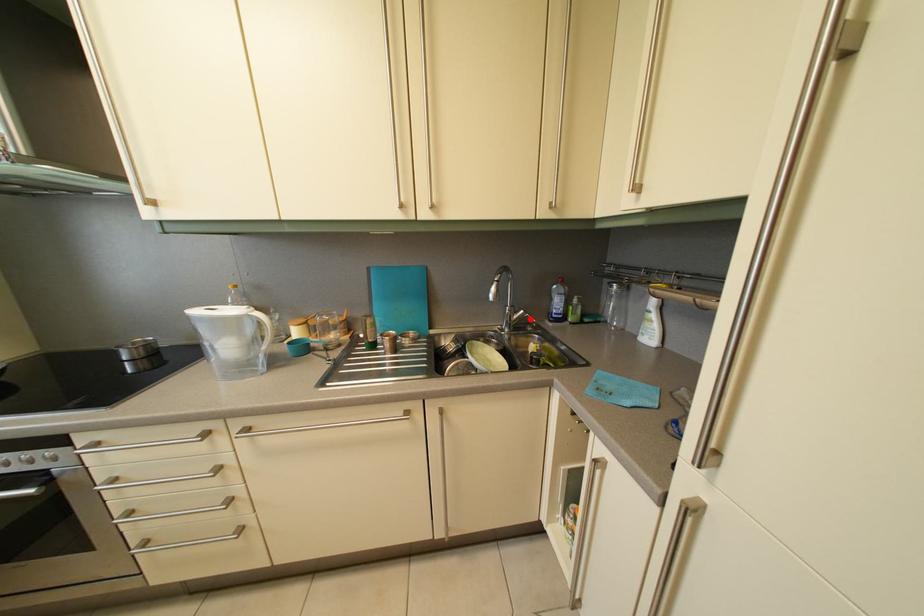
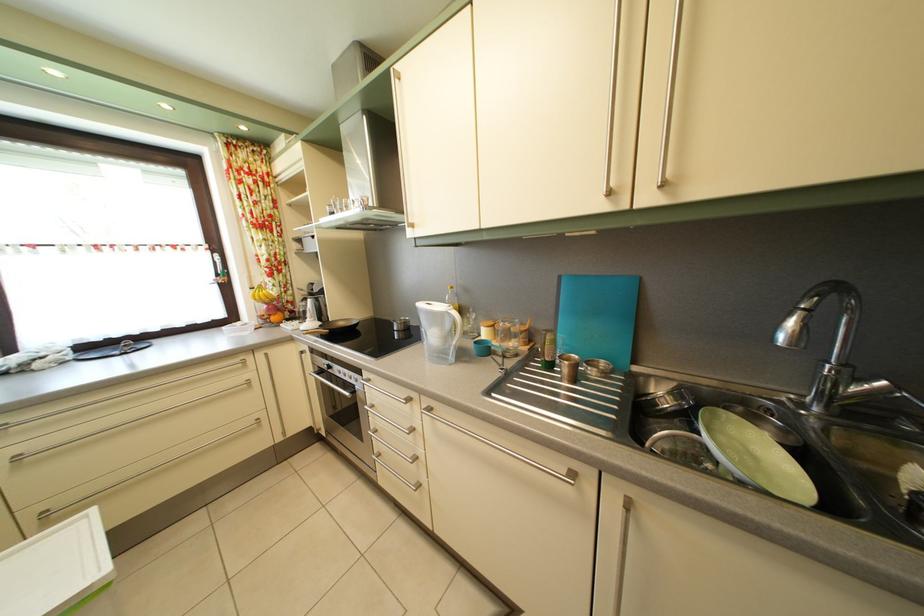
Where in the second image is the point corresponding to the highlighted location from the first image?

(893, 391)